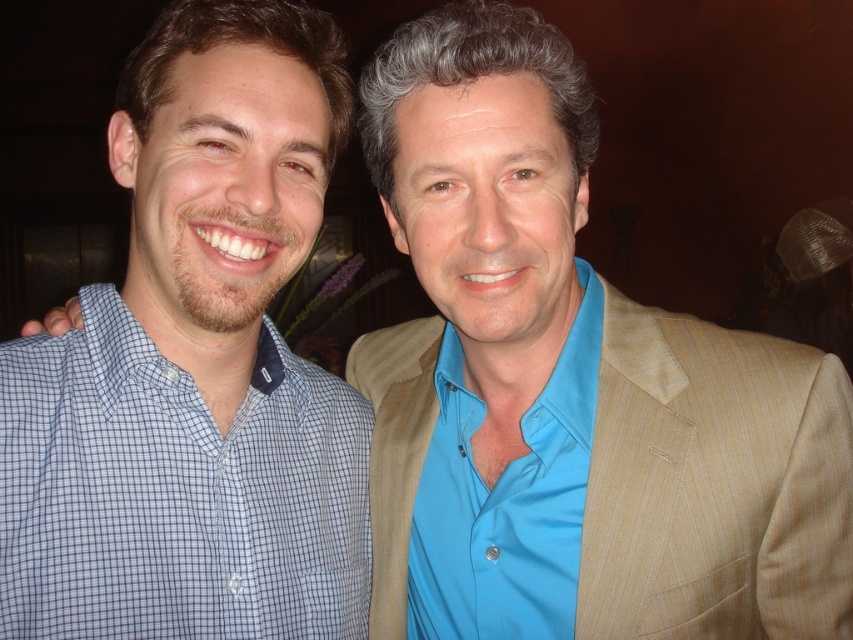
You are an AI analyzing the image. The blue checkered shirt at left is located at coordinates. What are its coordinates?

The blue checkered shirt at left is located at coordinates point (x=177, y=492).

You are standing at the point marked by coordinates point (219,600) and want to greet someone across the room. If you can comfortably reach out to shake hands with someone from your position, would you be able to do so without moving? Please consider the distance between you and the viewer.

The distance between point (219,600) and the viewer is 32.52 inches. Since the average comfortable handshake distance is around 2 to 3 feet, which is approximately 24 to 36 inches, you can comfortably reach out to shake hands without moving.

You are a photographer adjusting the camera settings to capture a clear photo of both the blue checkered shirt at left and the blue satin shirt at center. The camera has a depth of field that can focus on objects within a 10 inch range. Can both shirts be in focus at the same time?

The distance between the blue checkered shirt at left and the blue satin shirt at center is 8.50 inches, which is within the 10 inch range of the camera. Therefore, both shirts can be in focus simultaneously.